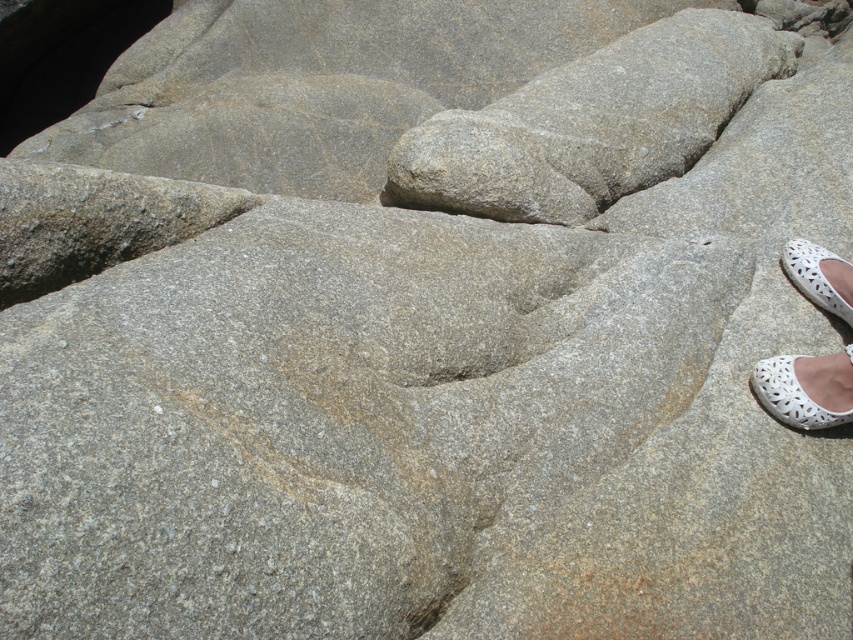
Question: Does white lace shoe at lower right appear under white mesh shoe at lower right?

Choices:
 (A) yes
 (B) no

Answer: (A)

Question: Which is farther from the white lace sandal at lower right?

Choices:
 (A) white mesh shoe at lower right
 (B) white lace shoe at lower right

Answer: (A)

Question: Which point is closer to the camera taking this photo?

Choices:
 (A) (845, 356)
 (B) (838, 301)
 (C) (764, 390)

Answer: (C)

Question: Is the position of white lace sandal at lower right less distant than that of white mesh shoe at lower right?

Choices:
 (A) yes
 (B) no

Answer: (A)

Question: Which of the following is the closest to the observer?

Choices:
 (A) white lace shoe at lower right
 (B) white mesh shoe at lower right

Answer: (A)

Question: Can you confirm if white lace sandal at lower right is wider than white mesh shoe at lower right?

Choices:
 (A) yes
 (B) no

Answer: (A)